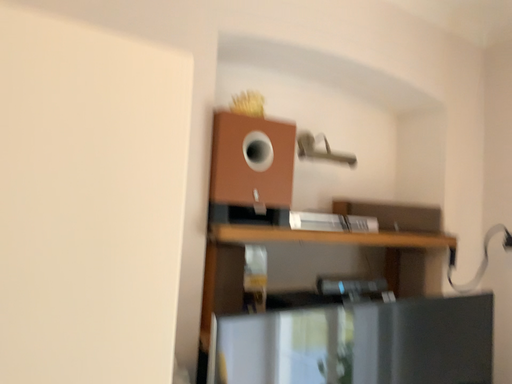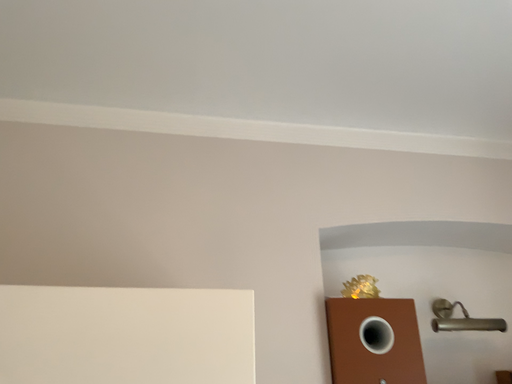
Question: How did the camera likely rotate when shooting the video?

Choices:
 (A) rotated upward
 (B) rotated downward

Answer: (A)